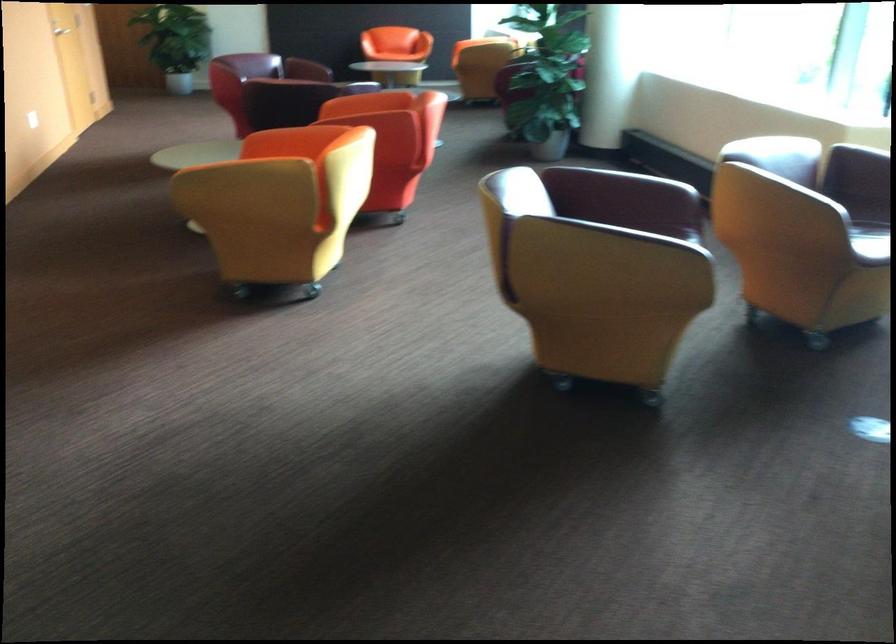
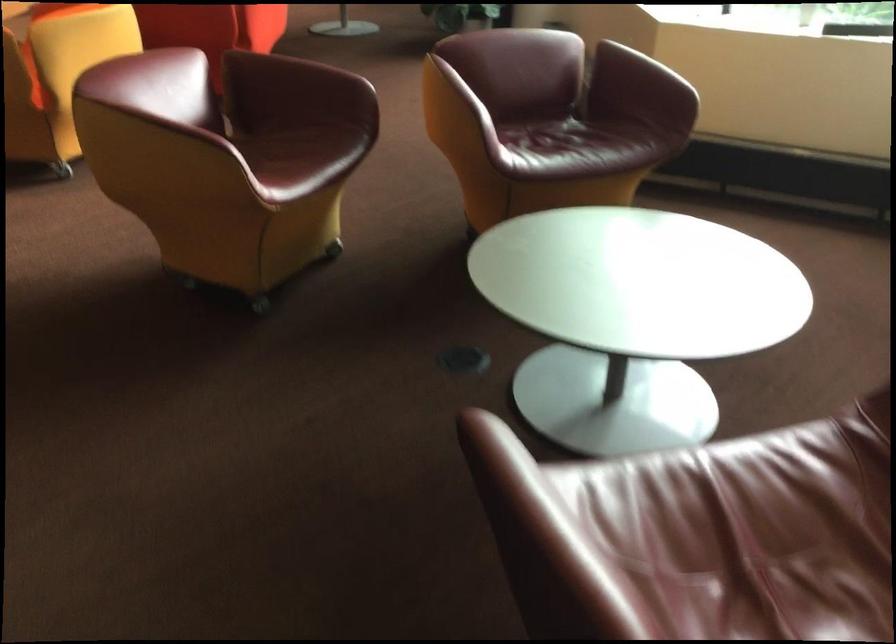
Question: In a continuous first-person perspective shot, in which direction is the camera moving?

Choices:
 (A) Left
 (B) Right
 (C) Forward
 (D) Backward

Answer: (B)